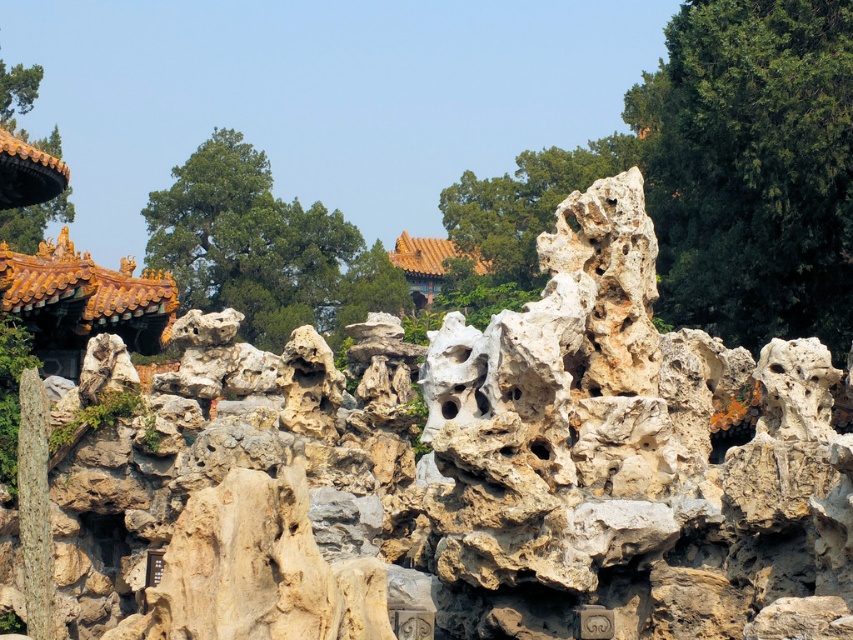
You are standing in a traditional Chinese garden and see a point marked at coordinates (752,168). According to the scene description, what object is located at this point?

The point at coordinates (752,168) indicates a green leafy tree at upper right.